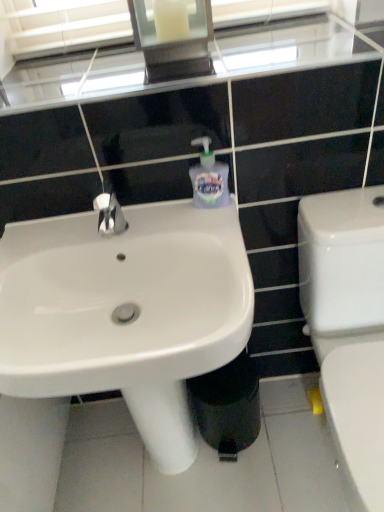
Question: Does point (195, 141) appear closer or farther from the camera than point (18, 344)?

Choices:
 (A) farther
 (B) closer

Answer: (A)

Question: Looking at their shapes, would you say translucent plastic soap dispenser at center is wider or thinner than white glossy sink at center?

Choices:
 (A) thin
 (B) wide

Answer: (A)

Question: Estimate the real-world distances between objects in this image. Which object is farther from the white glossy sink at center?

Choices:
 (A) translucent plastic soap dispenser at center
 (B) white glossy toilet at right
 (C) black plastic trash bin/can at lower center

Answer: (B)

Question: Which object is positioned farthest from the black plastic trash bin/can at lower center?

Choices:
 (A) white glossy sink at center
 (B) translucent plastic soap dispenser at center
 (C) white glossy toilet at right

Answer: (B)